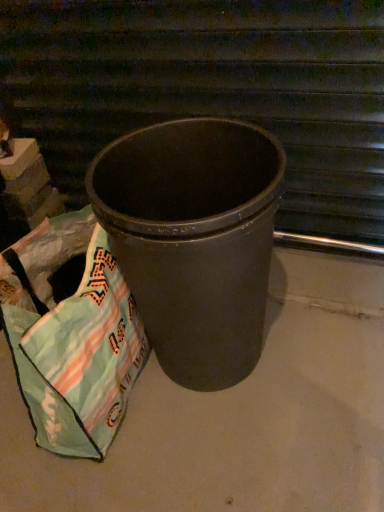
Question: Can you confirm if matte black trash can at center is taller than light green fabric bag at lower left?

Choices:
 (A) yes
 (B) no

Answer: (A)

Question: Is matte black trash can at center facing towards light green fabric bag at lower left?

Choices:
 (A) yes
 (B) no

Answer: (B)

Question: From the image's perspective, is matte black trash can at center above light green fabric bag at lower left?

Choices:
 (A) yes
 (B) no

Answer: (A)

Question: From a real-world perspective, is matte black trash can at center beneath light green fabric bag at lower left?

Choices:
 (A) no
 (B) yes

Answer: (A)

Question: Is matte black trash can at center facing away from light green fabric bag at lower left?

Choices:
 (A) no
 (B) yes

Answer: (A)

Question: From a real-world perspective, is light green fabric bag at lower left positioned above or below matte black trash can at center?

Choices:
 (A) below
 (B) above

Answer: (A)

Question: From the image's perspective, relative to matte black trash can at center, is light green fabric bag at lower left above or below?

Choices:
 (A) above
 (B) below

Answer: (B)

Question: Is light green fabric bag at lower left bigger or smaller than matte black trash can at center?

Choices:
 (A) big
 (B) small

Answer: (B)

Question: Which is correct: light green fabric bag at lower left is inside matte black trash can at center, or outside of it?

Choices:
 (A) outside
 (B) inside

Answer: (A)

Question: From the image's perspective, is matte gray concrete at center positioned above or below matte black trash can at center?

Choices:
 (A) above
 (B) below

Answer: (B)

Question: Is matte gray concrete at center inside or outside of matte black trash can at center?

Choices:
 (A) inside
 (B) outside

Answer: (B)

Question: Considering the positions of matte gray concrete at center and matte black trash can at center in the image, is matte gray concrete at center taller or shorter than matte black trash can at center?

Choices:
 (A) short
 (B) tall

Answer: (A)

Question: Does point (253, 407) appear closer or farther from the camera than point (11, 86)?

Choices:
 (A) closer
 (B) farther

Answer: (A)

Question: Considering the positions of matte black trash can at center and light green fabric bag at lower left in the image, is matte black trash can at center wider or thinner than light green fabric bag at lower left?

Choices:
 (A) thin
 (B) wide

Answer: (A)

Question: Visually, is matte black trash can at center positioned to the left or to the right of light green fabric bag at lower left?

Choices:
 (A) right
 (B) left

Answer: (A)